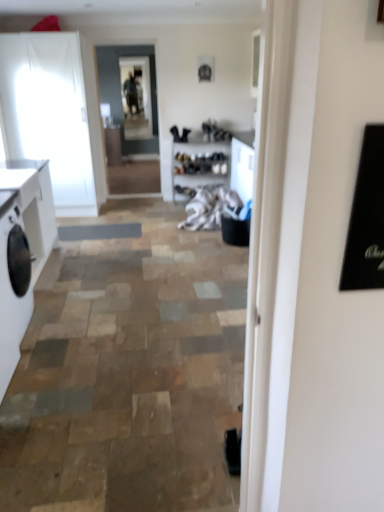
Question: Considering the relative positions of white glossy cabinet at left, the 1th cabinetry in the top-to-bottom sequence, and white matte washing machine at left in the image provided, is white glossy cabinet at left, the 1th cabinetry in the top-to-bottom sequence, to the left or to the right of white matte washing machine at left?

Choices:
 (A) left
 (B) right

Answer: (A)

Question: Considering the positions of white glossy cabinet at left, the second cabinetry viewed from the front, and white matte washing machine at left in the image, is white glossy cabinet at left, the second cabinetry viewed from the front, taller or shorter than white matte washing machine at left?

Choices:
 (A) tall
 (B) short

Answer: (A)

Question: Considering the real-world distances, which object is farthest from the white matte cabinet at left, acting as the second cabinetry starting from the top?

Choices:
 (A) clear glass door at center
 (B) white matte washing machine at left
 (C) white glossy counter top at left
 (D) white fabric at center
 (E) white glossy cabinet at left, the 1th cabinetry in the top-to-bottom sequence

Answer: (A)

Question: Considering the real-world distances, which object is closest to the white glossy counter top at left?

Choices:
 (A) white matte cabinet at left, acting as the second cabinetry starting from the top
 (B) clear glass door at center
 (C) white matte washing machine at left
 (D) white glossy cabinet at left, the 1th cabinetry in the top-to-bottom sequence
 (E) clear glass window screen at center

Answer: (A)